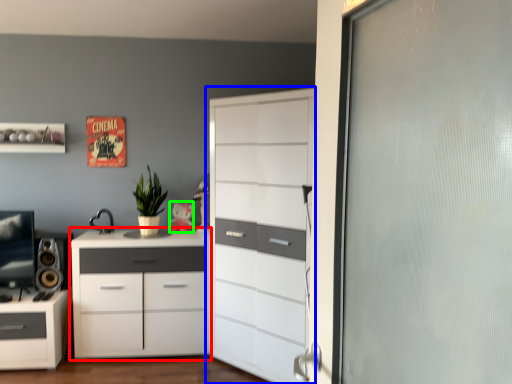
Question: Estimate the real-world distances between objects in this image. Which object is closer to chest of drawers (highlighted by a red box), chest of drawers (highlighted by a blue box) or toy (highlighted by a green box)?

Choices:
 (A) chest of drawers
 (B) toy

Answer: (A)